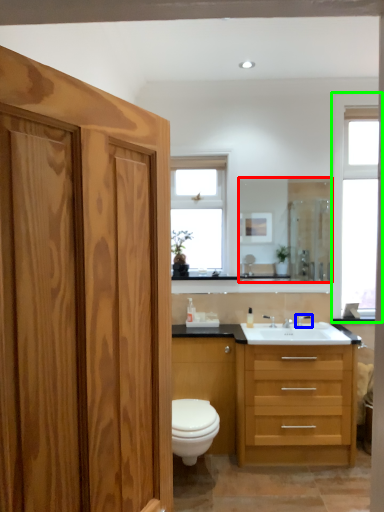
Question: Considering the real-world distances, which object is closest to mirror (highlighted by a red box)? faucet (highlighted by a blue box) or window (highlighted by a green box).

Choices:
 (A) faucet
 (B) window

Answer: (B)